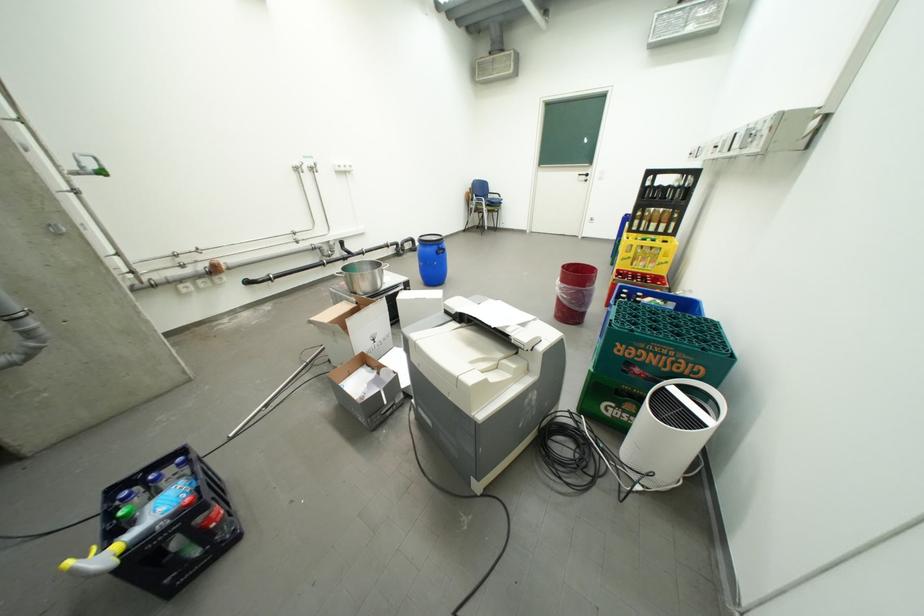
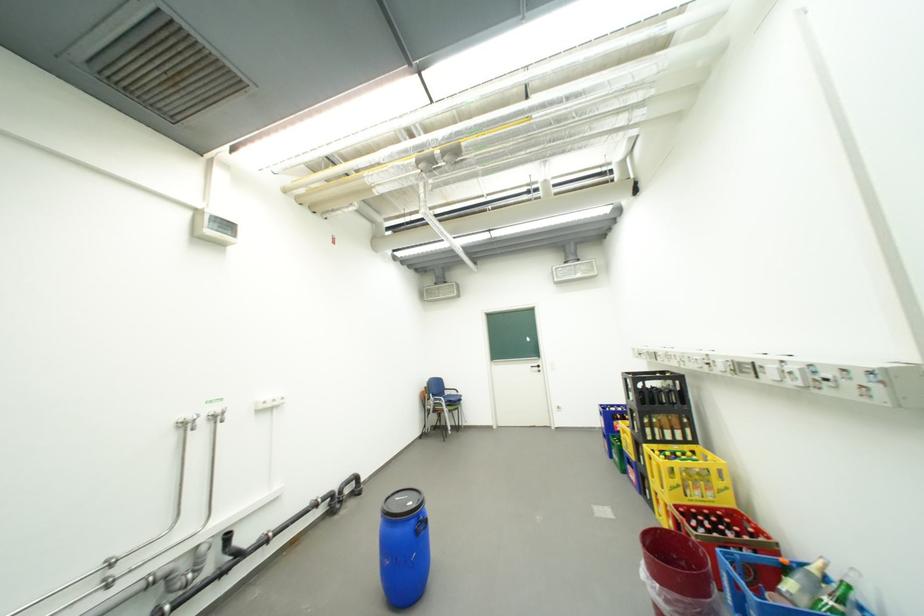
The first image is from the beginning of the video and the second image is from the end. How did the camera likely rotate when shooting the video?

The camera's rotation is toward right-up.